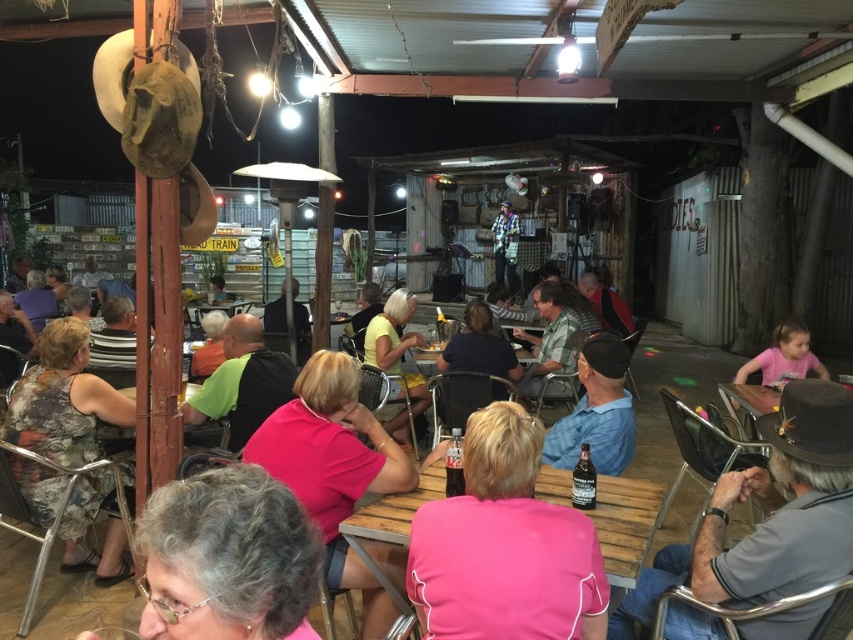
Question: Which point is closer to the camera?

Choices:
 (A) (375, 362)
 (B) (813, 365)
 (C) (492, 230)

Answer: (B)

Question: Which point is farther from the camera taking this photo?

Choices:
 (A) (589, 448)
 (B) (610, 497)

Answer: (B)

Question: Which object is closer to the camera taking this photo?

Choices:
 (A) wooden table at center
 (B) flannel shirt at center
 (C) gray felt hat at lower right
 (D) pink matte shirt at center

Answer: (C)

Question: Is the position of gray felt hat at lower right less distant than that of blue fabric shirt at center?

Choices:
 (A) yes
 (B) no

Answer: (A)

Question: Observing the image, what is the correct spatial positioning of printed fabric dress at lower left in reference to flannel shirt at center?

Choices:
 (A) above
 (B) below

Answer: (B)

Question: Can you confirm if wooden table at center is bigger than pink matte shirt at lower right?

Choices:
 (A) no
 (B) yes

Answer: (A)